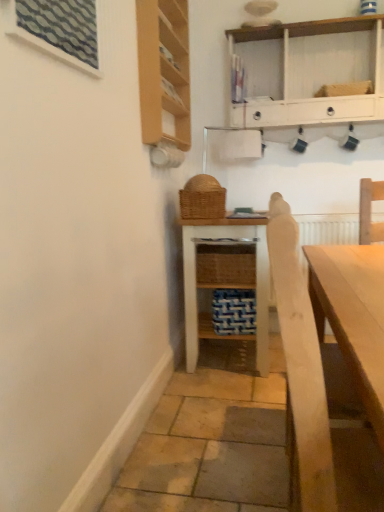
What is the approximate width of woven brown basket at center?

The width of woven brown basket at center is 9.98 inches.

The height and width of the screenshot is (512, 384). What are the coordinates of `white painted wood shelf at upper center, positioned as the second shelf in bottom-to-top order` in the screenshot? It's located at (304, 97).

The width and height of the screenshot is (384, 512). What do you see at coordinates (300, 370) in the screenshot? I see `light brown wooden armchair at right` at bounding box center [300, 370].

In order to face textured glass window at upper left, should I rotate leftwards or rightwards?

Rotate your view left by about 16.774°.

The image size is (384, 512). Describe the element at coordinates (225, 278) in the screenshot. I see `white wicker shelf at center, the second shelf when ordered from top to bottom` at that location.

Where is `white wicker shelf at center, placed as the 1th shelf when sorted from bottom to top`? white wicker shelf at center, placed as the 1th shelf when sorted from bottom to top is located at coordinates (225, 278).

Locate an element on the screen. The width and height of the screenshot is (384, 512). woven brown basket at center is located at coordinates (202, 198).

What are the coordinates of `window lying behind the light brown wooden armchair at right` in the screenshot? It's located at (59, 29).

Considering the sizes of objects light brown wooden armchair at right and textured glass window at upper left in the image provided, who is taller, light brown wooden armchair at right or textured glass window at upper left?

With more height is light brown wooden armchair at right.

Is light brown wooden armchair at right inside the boundaries of textured glass window at upper left, or outside?

light brown wooden armchair at right is spatially situated outside textured glass window at upper left.

What's the angular difference between light brown wooden armchair at right and textured glass window at upper left's facing directions?

The angle between the facing direction of light brown wooden armchair at right and the facing direction of textured glass window at upper left is 0.236 degrees.

Considering the positions of points (205, 322) and (290, 279), is point (205, 322) closer to camera compared to point (290, 279)?

That is False.

Is white wicker shelf at center, placed as the 1th shelf when sorted from bottom to top, outside of light brown wooden armchair at right?

white wicker shelf at center, placed as the 1th shelf when sorted from bottom to top, is positioned outside light brown wooden armchair at right.

How many degrees apart are the facing directions of white wicker shelf at center, placed as the 1th shelf when sorted from bottom to top, and light brown wooden armchair at right?

1.8 degrees.

Who is shorter, white wicker shelf at center, the second shelf when ordered from top to bottom, or light brown wooden armchair at right?

Standing shorter between the two is light brown wooden armchair at right.

Considering the relative sizes of white painted wood shelf at upper center, positioned as the second shelf in bottom-to-top order, and white wicker shelf at center, placed as the 1th shelf when sorted from bottom to top, in the image provided, is white painted wood shelf at upper center, positioned as the second shelf in bottom-to-top order, shorter than white wicker shelf at center, placed as the 1th shelf when sorted from bottom to top,?

Indeed, white painted wood shelf at upper center, positioned as the second shelf in bottom-to-top order, has a lesser height compared to white wicker shelf at center, placed as the 1th shelf when sorted from bottom to top.

Which of these two, white painted wood shelf at upper center, arranged as the first shelf when viewed from the top, or white wicker shelf at center, the second shelf when ordered from top to bottom, is thinner?

With smaller width is white painted wood shelf at upper center, arranged as the first shelf when viewed from the top.

How far apart are white painted wood shelf at upper center, arranged as the first shelf when viewed from the top, and white wicker shelf at center, the second shelf when ordered from top to bottom?

white painted wood shelf at upper center, arranged as the first shelf when viewed from the top, is 38.78 inches away from white wicker shelf at center, the second shelf when ordered from top to bottom.

Is white painted wood shelf at upper center, positioned as the second shelf in bottom-to-top order, at the right side of white wicker shelf at center, the second shelf when ordered from top to bottom?

Correct, you'll find white painted wood shelf at upper center, positioned as the second shelf in bottom-to-top order, to the right of white wicker shelf at center, the second shelf when ordered from top to bottom.

Where is `cabinetry in front of the woven brown basket at center`? The image size is (384, 512). cabinetry in front of the woven brown basket at center is located at coordinates (164, 70).

Which point is more distant from viewer, (194, 204) or (152, 46)?

Point (194, 204)

Between woven brown basket at center and light wood cabinet at upper left, which one has larger width?

With larger width is woven brown basket at center.

From a real-world perspective, between woven brown basket at center and light wood cabinet at upper left, who is vertically higher?

light wood cabinet at upper left is physically above.

Is there a large distance between textured glass window at upper left and white wicker shelf at center, placed as the 1th shelf when sorted from bottom to top?

Yes, textured glass window at upper left and white wicker shelf at center, placed as the 1th shelf when sorted from bottom to top, are quite far apart.

Considering the sizes of textured glass window at upper left and white wicker shelf at center, placed as the 1th shelf when sorted from bottom to top, in the image, is textured glass window at upper left wider or thinner than white wicker shelf at center, placed as the 1th shelf when sorted from bottom to top,?

In the image, textured glass window at upper left appears to be more narrow than white wicker shelf at center, placed as the 1th shelf when sorted from bottom to top.

In the scene shown: Who is smaller, textured glass window at upper left or white wicker shelf at center, the second shelf when ordered from top to bottom?

With smaller size is textured glass window at upper left.

In order to click on shelf below the textured glass window at upper left (from the image's perspective) in this screenshot , I will do `click(225, 278)`.

Which object is positioned more to the left, textured glass window at upper left or light brown wooden armchair at right?

textured glass window at upper left is more to the left.

Which object is closer to the camera, textured glass window at upper left or light brown wooden armchair at right?

Positioned in front is light brown wooden armchair at right.

Can you confirm if textured glass window at upper left is thinner than light brown wooden armchair at right?

Correct, the width of textured glass window at upper left is less than that of light brown wooden armchair at right.

Could you tell me if textured glass window at upper left is turned towards light brown wooden armchair at right?

No.

Is the depth of white painted wood shelf at upper center, arranged as the first shelf when viewed from the top, greater than that of light wood cabinet at upper left?

Yes, it is.

Is white painted wood shelf at upper center, positioned as the second shelf in bottom-to-top order, outside of light wood cabinet at upper left?

Yes, white painted wood shelf at upper center, positioned as the second shelf in bottom-to-top order, is outside of light wood cabinet at upper left.

Visually, is white painted wood shelf at upper center, arranged as the first shelf when viewed from the top, positioned to the left or to the right of light wood cabinet at upper left?

Clearly, white painted wood shelf at upper center, arranged as the first shelf when viewed from the top, is on the right of light wood cabinet at upper left in the image.

In the scene shown: Who is smaller, white painted wood shelf at upper center, positioned as the second shelf in bottom-to-top order, or light wood cabinet at upper left?

Smaller between the two is light wood cabinet at upper left.

Locate an element on the screen. This screenshot has width=384, height=512. window above the light brown wooden armchair at right (from the image's perspective) is located at coordinates (59, 29).

The image size is (384, 512). In order to click on shelf below the light brown wooden armchair at right (from a real-world perspective) in this screenshot , I will do `click(225, 278)`.

Looking at the image, which one is located closer to textured glass window at upper left, white painted wood shelf at upper center, arranged as the first shelf when viewed from the top, or woven brown basket at center?

Among the two, woven brown basket at center is located nearer to textured glass window at upper left.

When comparing their distances from white wicker shelf at center, the second shelf when ordered from top to bottom, does white painted wood shelf at upper center, arranged as the first shelf when viewed from the top, or textured glass window at upper left seem closer?

Based on the image, white painted wood shelf at upper center, arranged as the first shelf when viewed from the top, appears to be nearer to white wicker shelf at center, the second shelf when ordered from top to bottom.

When comparing their distances from white wicker shelf at center, placed as the 1th shelf when sorted from bottom to top, does textured glass window at upper left or woven brown basket at center seem closer?

woven brown basket at center lies closer to white wicker shelf at center, placed as the 1th shelf when sorted from bottom to top, than the other object.

Estimate the real-world distances between objects in this image. Which object is further from light brown wooden armchair at right, white painted wood shelf at upper center, arranged as the first shelf when viewed from the top, or white wicker shelf at center, the second shelf when ordered from top to bottom?

white painted wood shelf at upper center, arranged as the first shelf when viewed from the top.

From the picture: Based on their spatial positions, is woven brown basket at center or light brown wooden armchair at right further from white painted wood shelf at upper center, positioned as the second shelf in bottom-to-top order?

light brown wooden armchair at right.

Looking at this image, when comparing their distances from woven brown basket at center, does textured glass window at upper left or light brown wooden armchair at right seem closer?

textured glass window at upper left is closer to woven brown basket at center.

Looking at the image, which one is located further to white wicker shelf at center, placed as the 1th shelf when sorted from bottom to top, light wood cabinet at upper left or light brown wooden armchair at right?

light brown wooden armchair at right is further to white wicker shelf at center, placed as the 1th shelf when sorted from bottom to top.

Estimate the real-world distances between objects in this image. Which object is closer to white wicker shelf at center, the second shelf when ordered from top to bottom, woven brown basket at center or white painted wood shelf at upper center, positioned as the second shelf in bottom-to-top order?

The object closer to white wicker shelf at center, the second shelf when ordered from top to bottom, is woven brown basket at center.

Find the location of a particular element. This screenshot has width=384, height=512. basket between light wood cabinet at upper left and white wicker shelf at center, placed as the 1th shelf when sorted from bottom to top, from top to bottom is located at coordinates (202, 198).

Find the location of a particular element. This screenshot has height=512, width=384. shelf between light brown wooden armchair at right and woven brown basket at center from front to back is located at coordinates (225, 278).

This screenshot has width=384, height=512. Find the location of `cabinetry between light brown wooden armchair at right and white wicker shelf at center, the second shelf when ordered from top to bottom, along the z-axis`. cabinetry between light brown wooden armchair at right and white wicker shelf at center, the second shelf when ordered from top to bottom, along the z-axis is located at coordinates (164, 70).

Where is `shelf positioned between textured glass window at upper left and white painted wood shelf at upper center, arranged as the first shelf when viewed from the top, from near to far`? The image size is (384, 512). shelf positioned between textured glass window at upper left and white painted wood shelf at upper center, arranged as the first shelf when viewed from the top, from near to far is located at coordinates (225, 278).